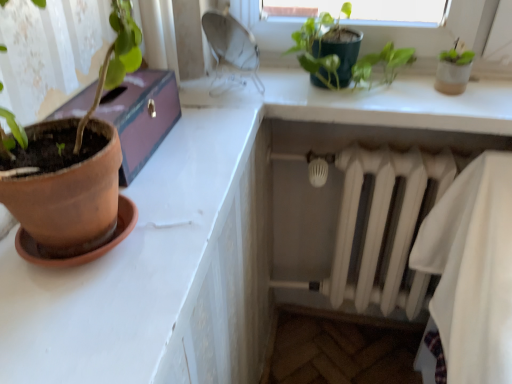
Find the location of `free location to the right of green matte plant at upper center`. free location to the right of green matte plant at upper center is located at coordinates (458, 95).